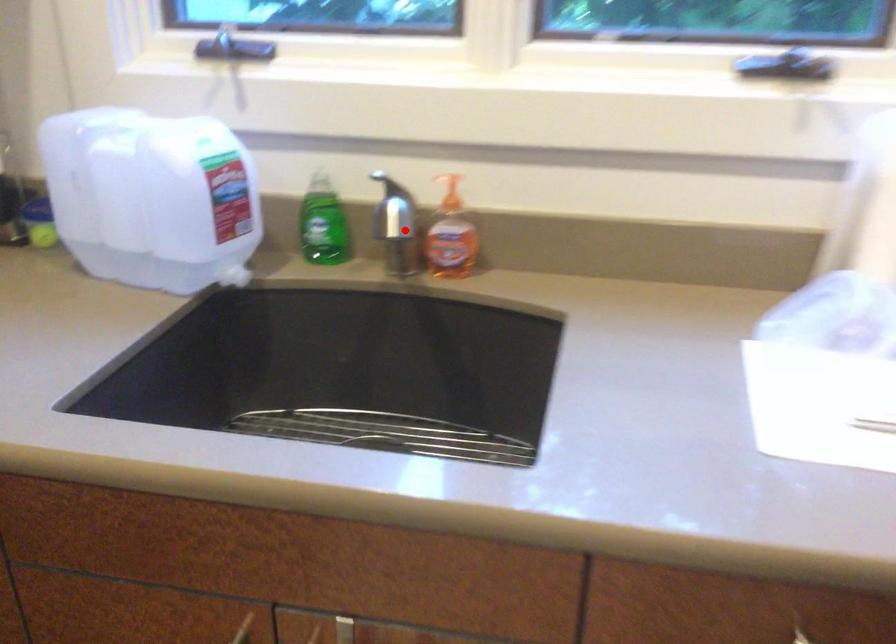
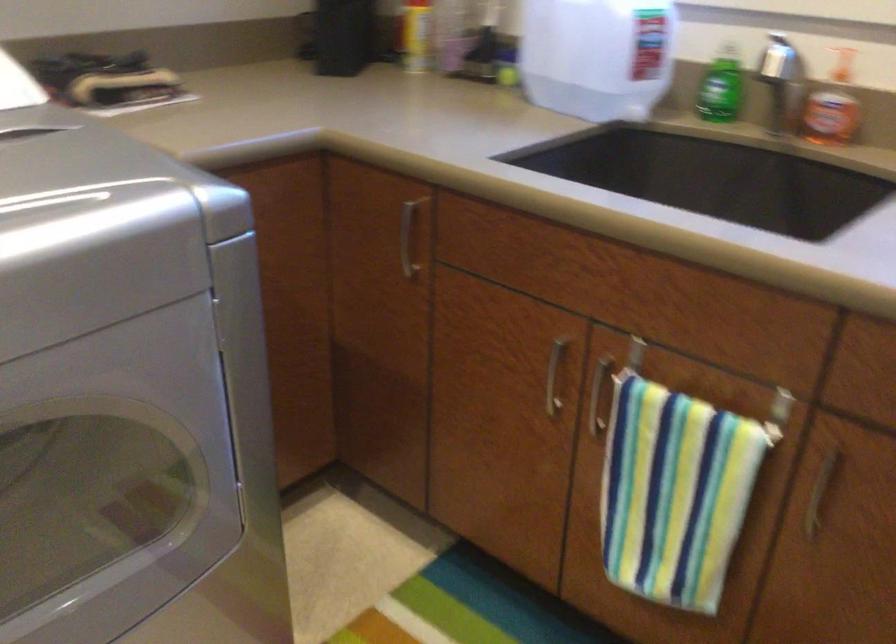
Find the pixel in the second image that matches the highlighted location in the first image.

(788, 96)